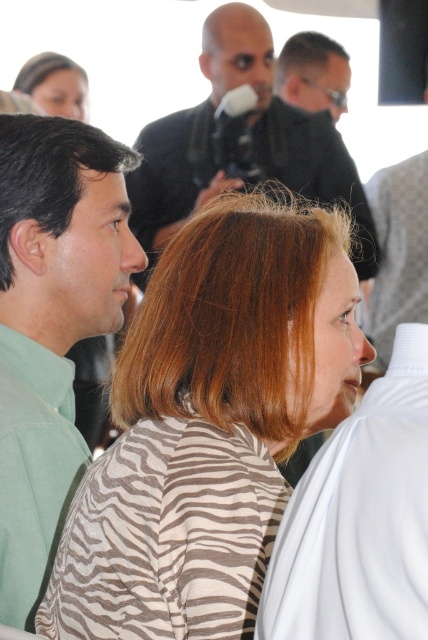
Question: Is zebra print scarf at upper left below dark brown hair at upper center?

Choices:
 (A) yes
 (B) no

Answer: (A)

Question: Considering the relative positions of dark brown hair at left and dark brown hair at upper center in the image provided, where is dark brown hair at left located with respect to dark brown hair at upper center?

Choices:
 (A) left
 (B) right

Answer: (A)

Question: Which of the following is the farthest from the observer?

Choices:
 (A) (199, 317)
 (B) (41, 92)

Answer: (B)

Question: Which object is positioned closest to the black matte microphone at upper center?

Choices:
 (A) zebra print scarf at upper left
 (B) blonde hair at center

Answer: (A)

Question: Does blonde hair at center appear over dark brown hair at left?

Choices:
 (A) no
 (B) yes

Answer: (A)

Question: Which of these objects is positioned farthest from the blonde hair at center?

Choices:
 (A) zebra print scarf at upper left
 (B) dark brown hair at upper center

Answer: (B)